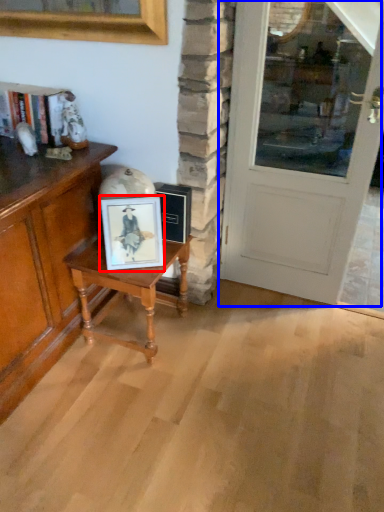
Question: Among these objects, which one is nearest to the camera, picture frame (highlighted by a red box) or door (highlighted by a blue box)?

Choices:
 (A) picture frame
 (B) door

Answer: (B)